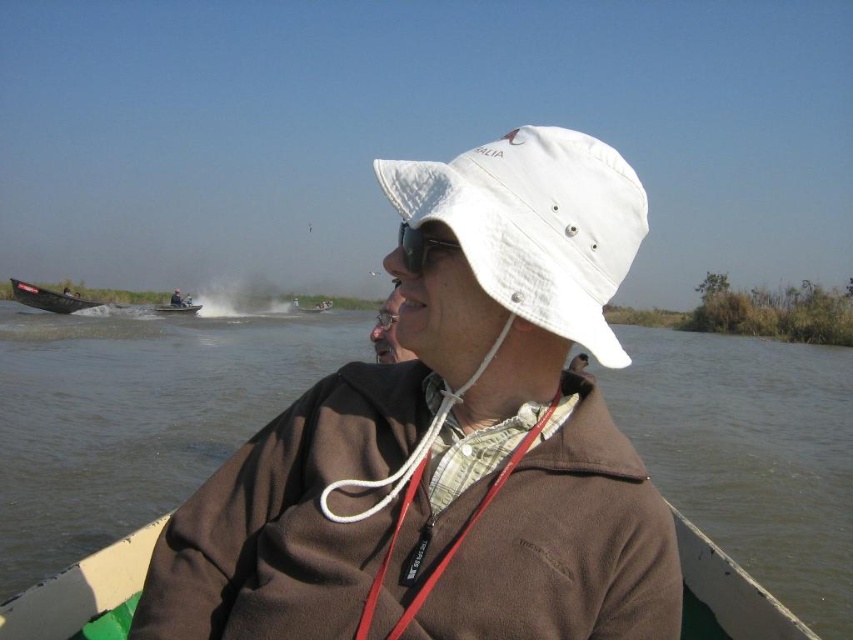
Is point (97, 465) positioned behind point (560, 168)?

That is True.

Can you confirm if brown water at center is positioned to the right of white fabric hat at center?

Yes, brown water at center is to the right of white fabric hat at center.

What do you see at coordinates (134, 413) in the screenshot? The width and height of the screenshot is (853, 640). I see `brown water at center` at bounding box center [134, 413].

The image size is (853, 640). I want to click on brown water at center, so click(134, 413).

Between white fabric hat at center and metallic gray boat at left, which one is positioned higher?

metallic gray boat at left is higher up.

Can you confirm if white fabric hat at center is shorter than metallic gray boat at left?

No, white fabric hat at center is not shorter than metallic gray boat at left.

Which is in front, point (575, 246) or point (67, 310)?

Point (575, 246) is in front.

Identify the location of white fabric hat at center. (534, 225).

Does white matte hat at center come behind green plastic boat at center?

That is False.

Between white matte hat at center and green plastic boat at center, which one is positioned higher?

green plastic boat at center

The height and width of the screenshot is (640, 853). Describe the element at coordinates (450, 440) in the screenshot. I see `white matte hat at center` at that location.

Image resolution: width=853 pixels, height=640 pixels. Identify the location of white matte hat at center. (450, 440).